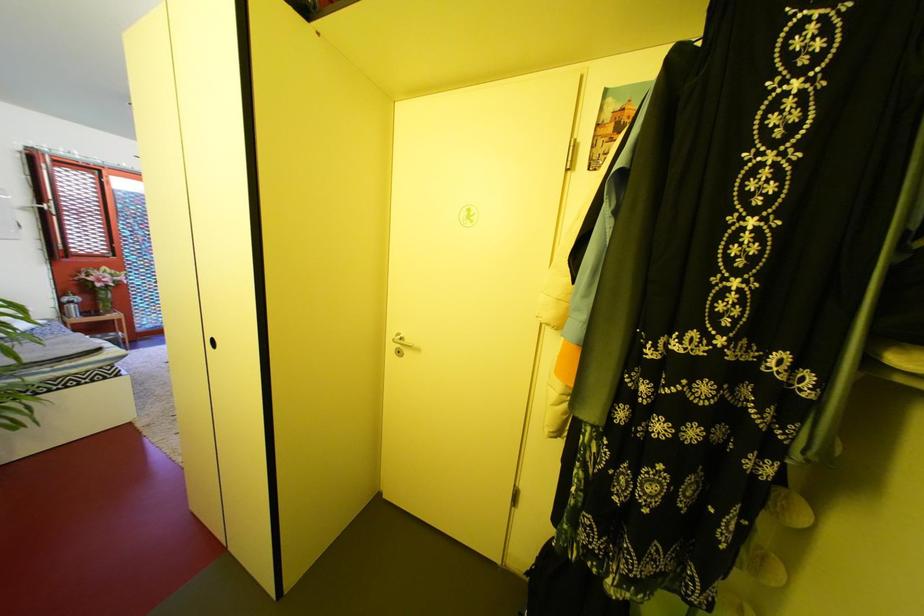
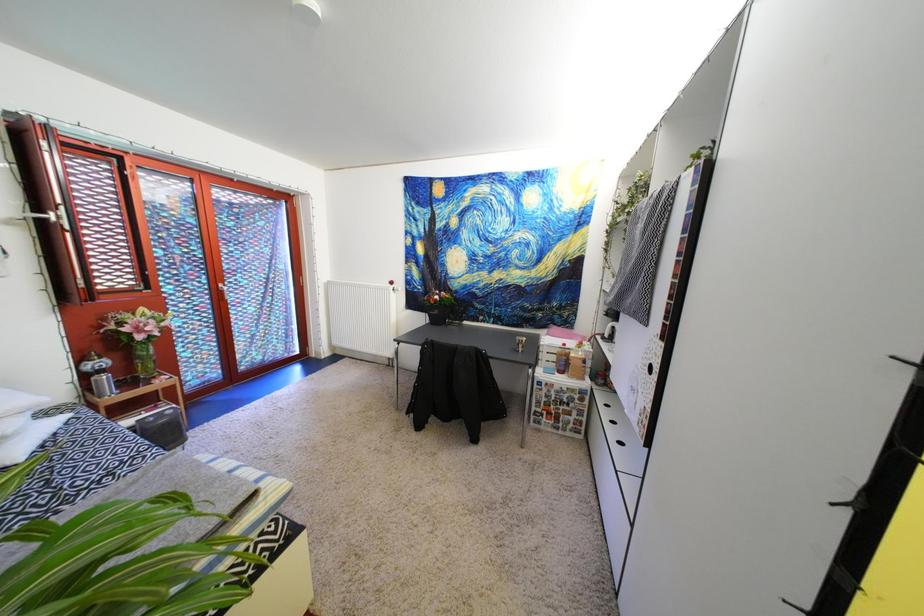
In a continuous first-person perspective shot, in which direction is the camera moving?

The movement direction of the cameraman is left, forward.